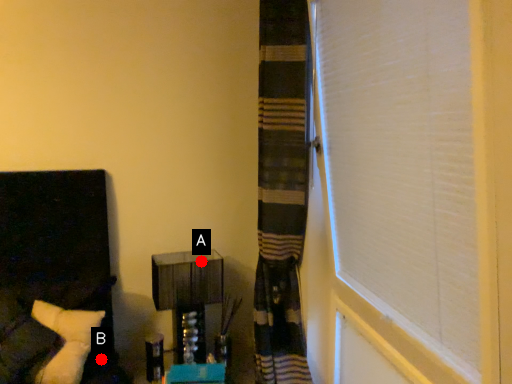
Question: Two points are circled on the image, labeled by A and B beside each circle. Which of the following is the farthest from the observer?

Choices:
 (A) A is further
 (B) B is further

Answer: (A)